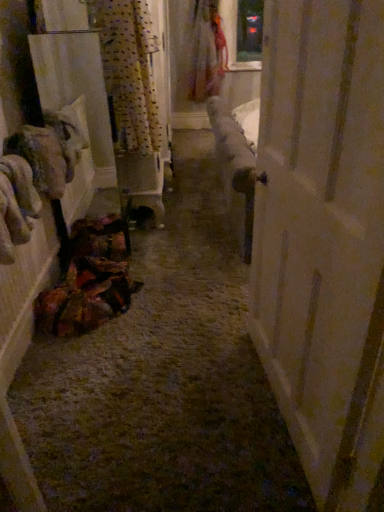
Question: Is point (334, 172) closer or farther from the camera than point (193, 51)?

Choices:
 (A) closer
 (B) farther

Answer: (A)

Question: From the image's perspective, relative to floral fabric dress at upper center, is white wood door at right above or below?

Choices:
 (A) above
 (B) below

Answer: (B)

Question: Which object is the closest to the patterned fabric curtain at upper left?

Choices:
 (A) floral fabric dress at upper center
 (B) white wood door at right

Answer: (B)

Question: Which of these objects is positioned farthest from the white wood door at right?

Choices:
 (A) floral fabric dress at upper center
 (B) patterned fabric curtain at upper left

Answer: (A)